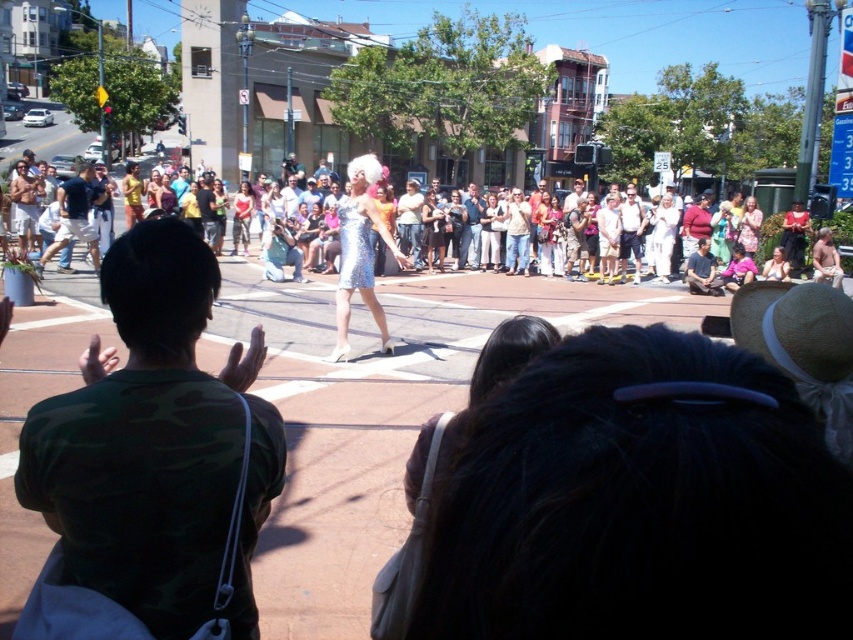
Which is below, camouflage shirt at center or matte blue jeans at left?

camouflage shirt at center

Is point (167, 554) closer to viewer compared to point (76, 193)?

Yes, point (167, 554) is closer to viewer.

Who is more distant from viewer, [177,449] or [56,234]?

Positioned behind is point [56,234].

What are the coordinates of `camouflage shirt at center` in the screenshot? It's located at (155, 445).

Consider the image. Who is shorter, camouflage shirt at center or shiny silver dress at center?

Standing shorter between the two is camouflage shirt at center.

What do you see at coordinates (155, 445) in the screenshot?
I see `camouflage shirt at center` at bounding box center [155, 445].

The width and height of the screenshot is (853, 640). I want to click on camouflage shirt at center, so click(155, 445).

Is matte blue jeans at left wider than shiny silver dress at center?

No.

Looking at this image, does matte blue jeans at left have a smaller size compared to shiny silver dress at center?

Actually, matte blue jeans at left might be larger than shiny silver dress at center.

Is point (61, 237) behind point (134, 164)?

No, it is not.

You are a GUI agent. You are given a task and a screenshot of the screen. Output one action in this format:
    pyautogui.click(x=<x>, y=<y>)
    Task: Click on the matte blue jeans at left
    This screenshot has height=640, width=853.
    Given the screenshot: What is the action you would take?
    pyautogui.click(x=74, y=216)